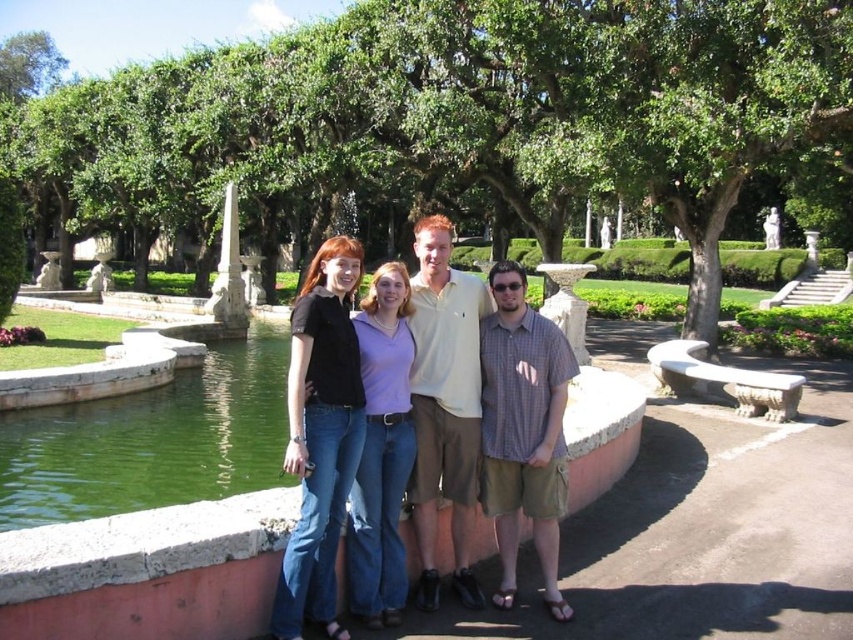
Question: Which of the following is the farthest from the observer?

Choices:
 (A) matte black shirt at center
 (B) denim jeans at center

Answer: (A)

Question: Considering the relative positions of denim jeans at center and light beige polo shirt at center in the image provided, where is denim jeans at center located with respect to light beige polo shirt at center?

Choices:
 (A) above
 (B) below

Answer: (B)

Question: Which object is the closest to the denim jeans at center?

Choices:
 (A) checkered fabric shirt at center
 (B) matte purple shirt at center
 (C) green liquid water at lower left

Answer: (B)

Question: Does green liquid water at lower left appear on the right side of matte purple shirt at center?

Choices:
 (A) yes
 (B) no

Answer: (B)

Question: Is green liquid water at lower left wider than light beige polo shirt at center?

Choices:
 (A) no
 (B) yes

Answer: (B)

Question: Among these points, which one is farthest from the camera?

Choices:
 (A) (540, 397)
 (B) (358, 429)
 (C) (32, 474)
 (D) (436, 332)

Answer: (C)